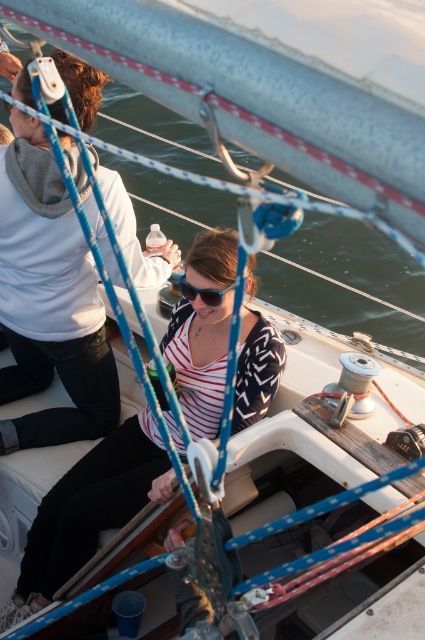
Question: Can you confirm if white hoodie at upper left is positioned below sunglasses at center?

Choices:
 (A) no
 (B) yes

Answer: (A)

Question: Can you confirm if striped fabric shirt at center is bigger than sunglasses at center?

Choices:
 (A) no
 (B) yes

Answer: (B)

Question: Which object is the farthest from the striped fabric shirt at center?

Choices:
 (A) sunglasses at center
 (B) white hoodie at upper left

Answer: (B)

Question: Can you confirm if white hoodie at upper left is thinner than striped fabric shirt at center?

Choices:
 (A) yes
 (B) no

Answer: (A)

Question: Which point is closer to the camera taking this photo?

Choices:
 (A) (76, 170)
 (B) (209, 310)

Answer: (B)

Question: Among these objects, which one is nearest to the camera?

Choices:
 (A) sunglasses at center
 (B) white hoodie at upper left

Answer: (B)